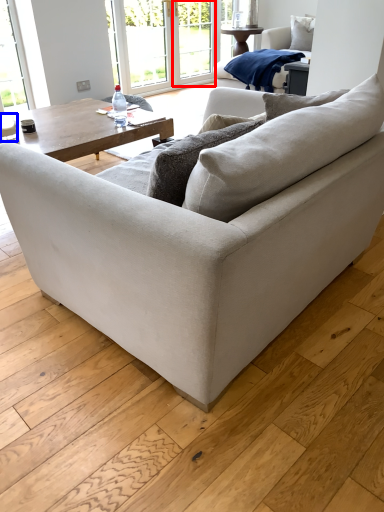
Question: Which object is further to the camera taking this photo, screen door (highlighted by a red box) or coffee cup (highlighted by a blue box)?

Choices:
 (A) screen door
 (B) coffee cup

Answer: (A)